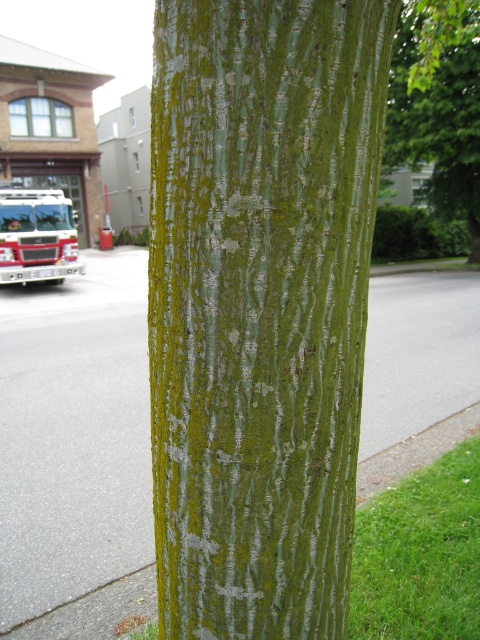
Question: Does gray asphalt pavement at center come in front of white glossy fire truck at left?

Choices:
 (A) yes
 (B) no

Answer: (A)

Question: Is green rough bark at upper right thinner than white glossy fire truck at left?

Choices:
 (A) no
 (B) yes

Answer: (A)

Question: Which point is closer to the camera taking this photo?

Choices:
 (A) (478, 148)
 (B) (214, 513)
 (C) (0, 269)

Answer: (B)

Question: Which of the following is the closest to the observer?

Choices:
 (A) (71, 236)
 (B) (468, 292)
 (C) (436, 124)

Answer: (B)

Question: Among these points, which one is farthest from the camera?

Choices:
 (A) (12, 228)
 (B) (460, 138)

Answer: (B)

Question: From the image, what is the correct spatial relationship of gray asphalt pavement at center in relation to green rough bark at upper right?

Choices:
 (A) above
 (B) below

Answer: (B)